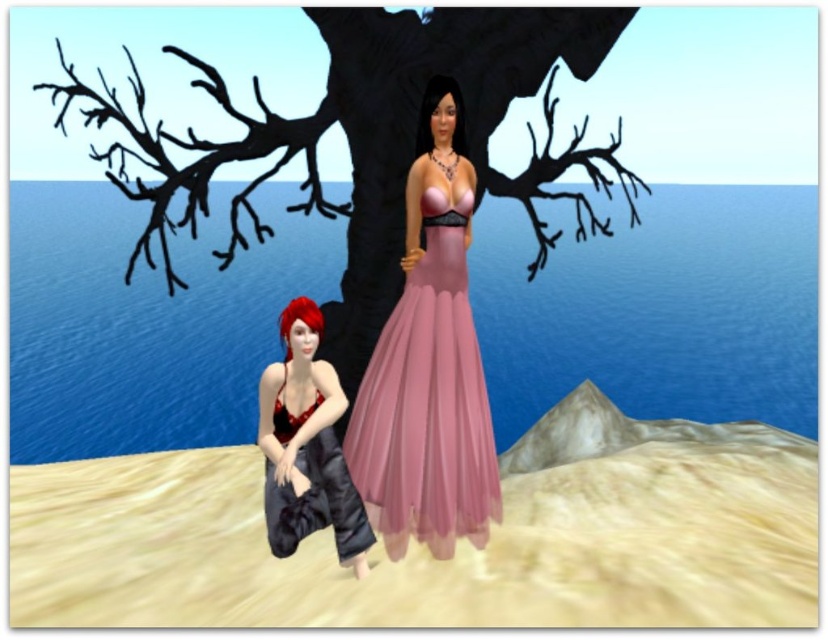
Looking at this image, who is more distant from viewer, [301,454] or [453,156]?

The point [453,156] is behind.

Is shiny black dress at lower left shorter than pink satin bikini top at center?

In fact, shiny black dress at lower left may be taller than pink satin bikini top at center.

Where is `shiny black dress at lower left`? The height and width of the screenshot is (640, 828). shiny black dress at lower left is located at coordinates (307, 445).

Can you confirm if blue water at center is positioned to the right of shiny black dress at lower left?

No, blue water at center is not to the right of shiny black dress at lower left.

Find the location of a particular element. blue water at center is located at coordinates (658, 310).

This screenshot has height=640, width=828. I want to click on blue water at center, so click(x=658, y=310).

From the picture: Measure the distance between point (x=218, y=420) and camera.

Point (x=218, y=420) is 11.62 meters away from camera.

Which is above, blue water at center or shiny red bikini top at lower left?

blue water at center is higher up.

Where is `blue water at center`? blue water at center is located at coordinates (658, 310).